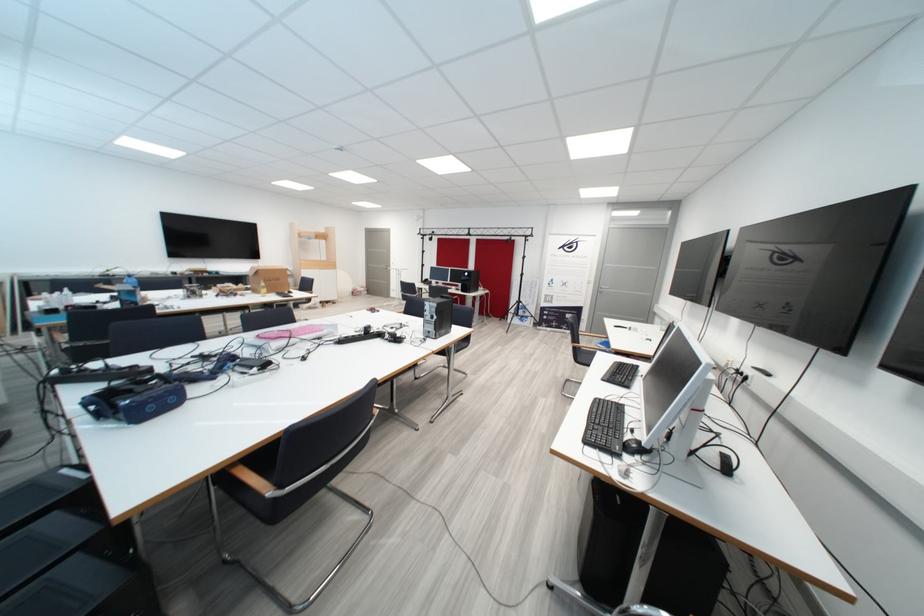
Locate an element on the screen. This screenshot has height=616, width=924. black chair armrest is located at coordinates (249, 477).